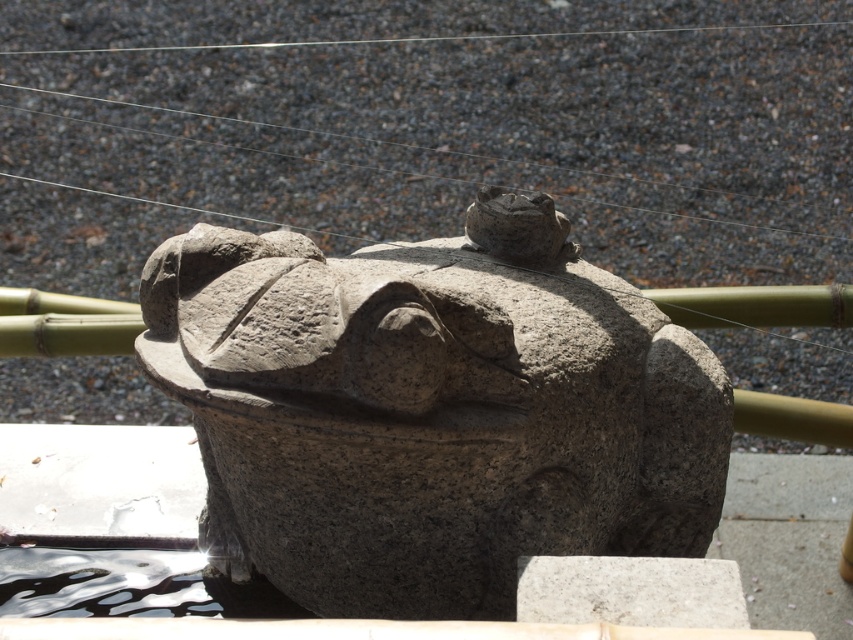
Is granite statue at center in front of gray granite stone at center?

No.

Does granite statue at center have a larger size compared to gray granite stone at center?

Yes, granite statue at center is bigger than gray granite stone at center.

Who is more forward, (x=144, y=355) or (x=614, y=616)?

Point (x=614, y=616)

At what (x,y) coordinates should I click in order to perform the action: click on granite statue at center. Please return your answer as a coordinate pair (x, y). The image size is (853, 640). Looking at the image, I should click on (431, 410).